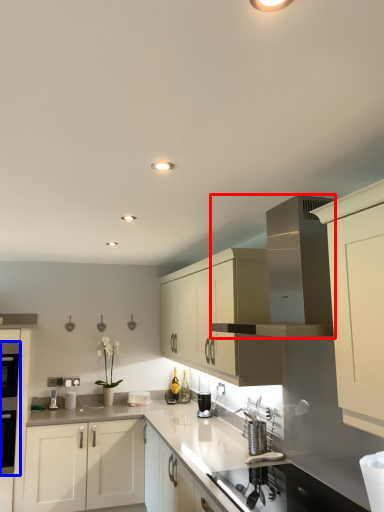
Question: Which object is closer to the camera taking this photo, vent (highlighted by a red box) or oven (highlighted by a blue box)?

Choices:
 (A) vent
 (B) oven

Answer: (A)